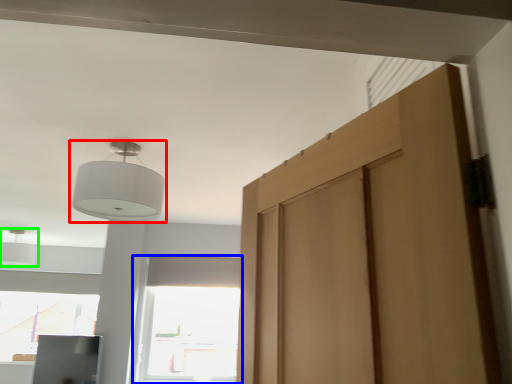
Question: Based on their relative distances, which object is nearer to lamp (highlighted by a red box)? Choose from window (highlighted by a blue box) and light (highlighted by a green box).

Choices:
 (A) window
 (B) light

Answer: (A)